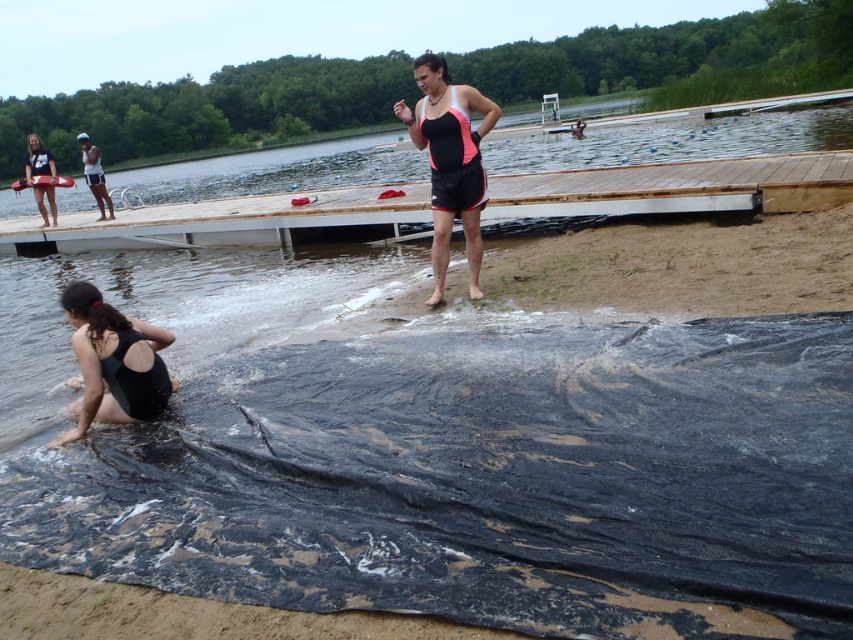
Based on the photo, is wooden dock at center bigger than black matte swimsuit at lower left?

Correct, wooden dock at center is larger in size than black matte swimsuit at lower left.

Which of these two, wooden dock at center or black matte swimsuit at lower left, stands shorter?

Standing shorter between the two is black matte swimsuit at lower left.

Identify the location of wooden dock at center. (233, 221).

Image resolution: width=853 pixels, height=640 pixels. What are the coordinates of `wooden dock at center` in the screenshot? It's located at (233, 221).

Does wooden dock at center have a lesser height compared to matte black swimsuit at center?

Correct, wooden dock at center is not as tall as matte black swimsuit at center.

Between wooden dock at center and matte black swimsuit at center, which one appears on the right side from the viewer's perspective?

matte black swimsuit at center

Is point (366, 209) behind point (479, 248)?

Yes, it is.

Where is `wooden dock at center`? The height and width of the screenshot is (640, 853). wooden dock at center is located at coordinates (233, 221).

Consider the image. Is matte black swimsuit at center wider than black matte swimsuit at lower left?

Indeed, matte black swimsuit at center has a greater width compared to black matte swimsuit at lower left.

Does matte black swimsuit at center lie behind black matte swimsuit at lower left?

Yes, it is behind black matte swimsuit at lower left.

This screenshot has height=640, width=853. What are the coordinates of `matte black swimsuit at center` in the screenshot? It's located at (450, 161).